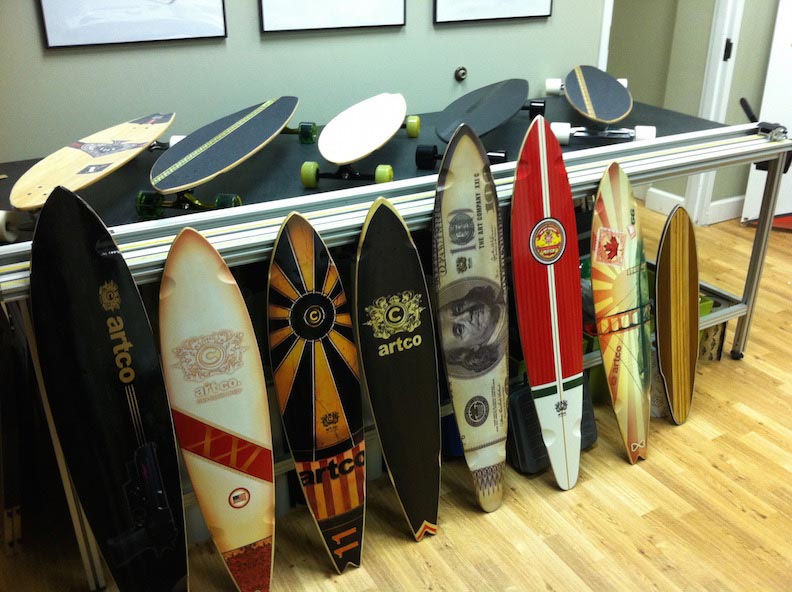
Identify the location of doorway. (665, 43).